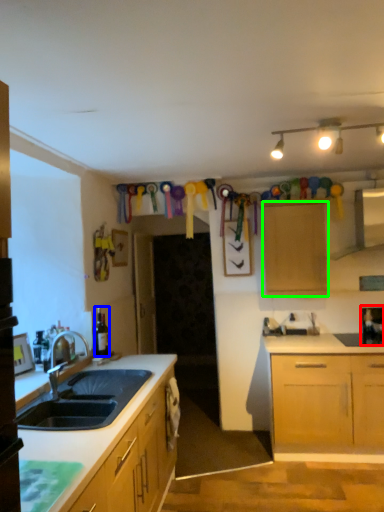
Question: Based on their relative distances, which object is farther from appliance (highlighted by a red box)? Choose from bottle (highlighted by a blue box) and cabinetry (highlighted by a green box).

Choices:
 (A) bottle
 (B) cabinetry

Answer: (A)